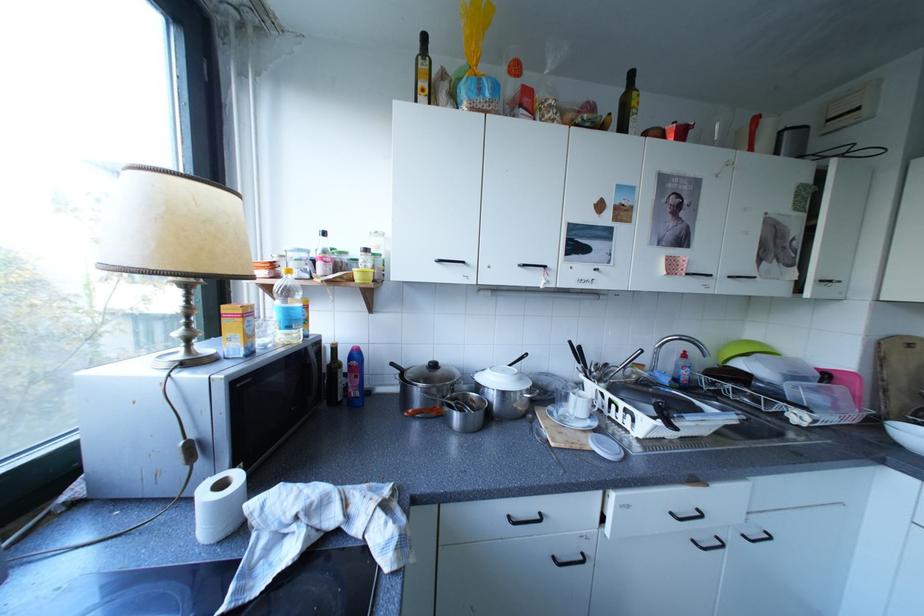
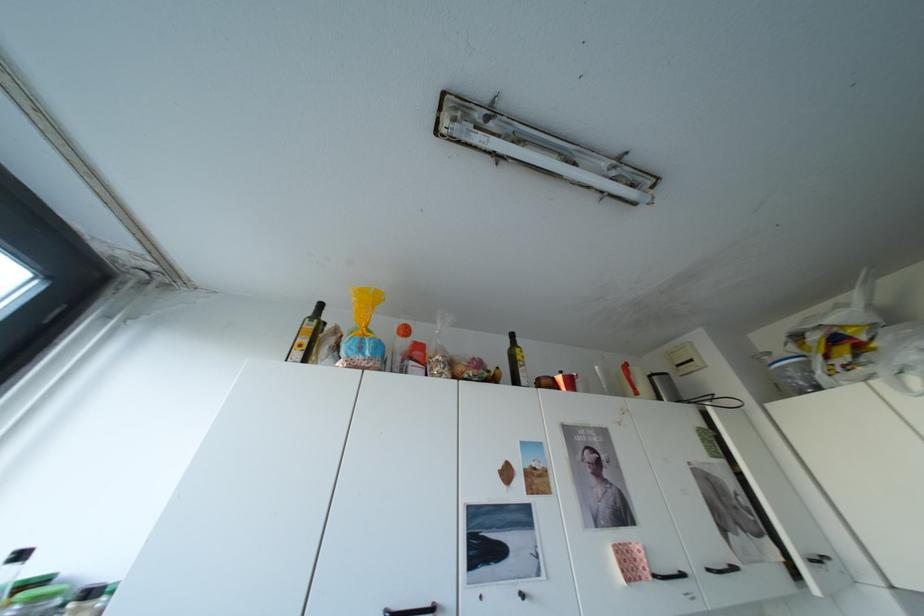
Question: How did the camera likely rotate?

Choices:
 (A) Left
 (B) Right
 (C) Up
 (D) Down

Answer: (C)